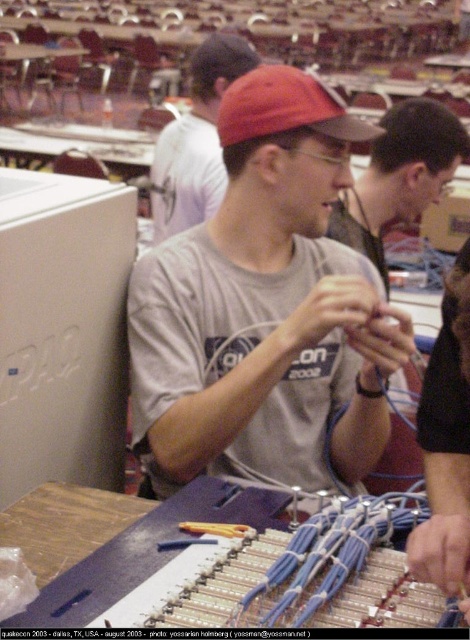
Is white plastic computer at left smaller than matte gray t-shirt at center?

Correct, white plastic computer at left occupies less space than matte gray t-shirt at center.

Does point (100, 394) come in front of point (239, 67)?

Yes, it is in front of point (239, 67).

The height and width of the screenshot is (640, 470). Find the location of `white plastic computer at left`. white plastic computer at left is located at coordinates pyautogui.click(x=62, y=330).

Which is behind, point (289, 234) or point (314, 93)?

The point (289, 234) is more distant.

Is gray cotton t-shirt at center to the right of red matte cap at center from the viewer's perspective?

No, gray cotton t-shirt at center is not to the right of red matte cap at center.

Between point (197, 460) and point (245, 97), which one is positioned behind?

Positioned behind is point (245, 97).

This screenshot has height=640, width=470. I want to click on gray cotton t-shirt at center, so click(265, 307).

Is gray cotton t-shirt at center shorter than white plastic computer at left?

No.

Which is more to the right, gray cotton t-shirt at center or white plastic computer at left?

gray cotton t-shirt at center is more to the right.

The width and height of the screenshot is (470, 640). What do you see at coordinates (265, 307) in the screenshot?
I see `gray cotton t-shirt at center` at bounding box center [265, 307].

Find the location of a particular element. gray cotton t-shirt at center is located at coordinates (265, 307).